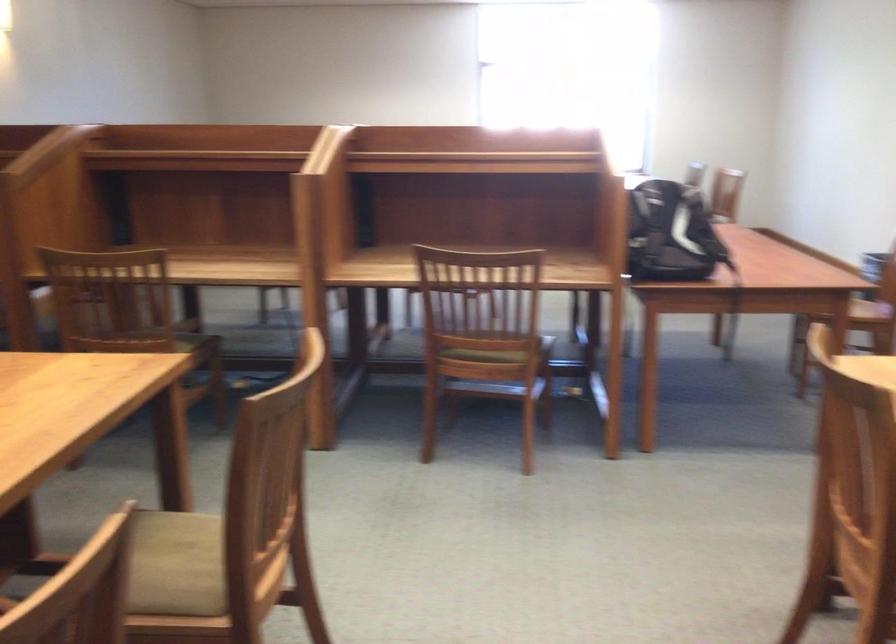
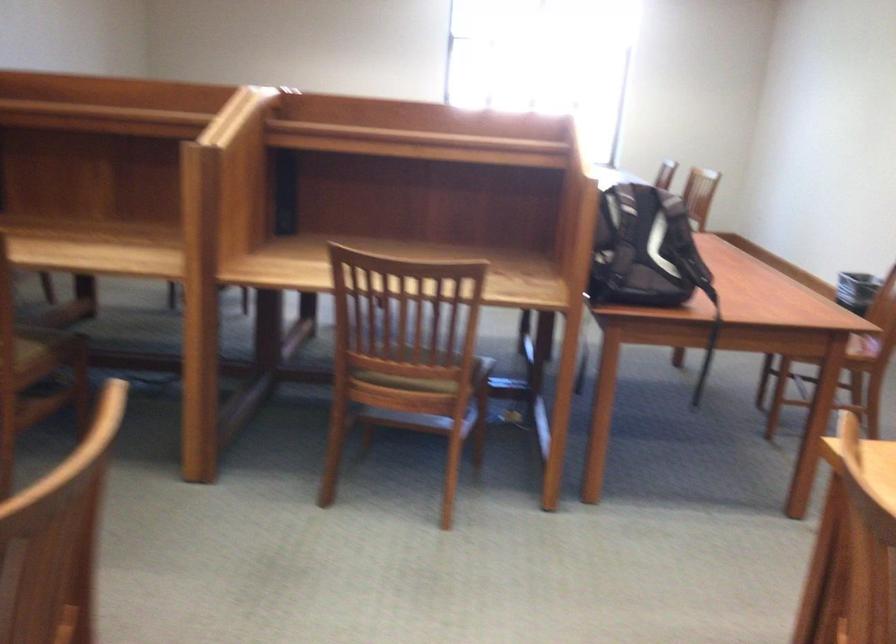
Where in the second image is the point corresponding to (x=497, y=351) from the first image?

(421, 379)